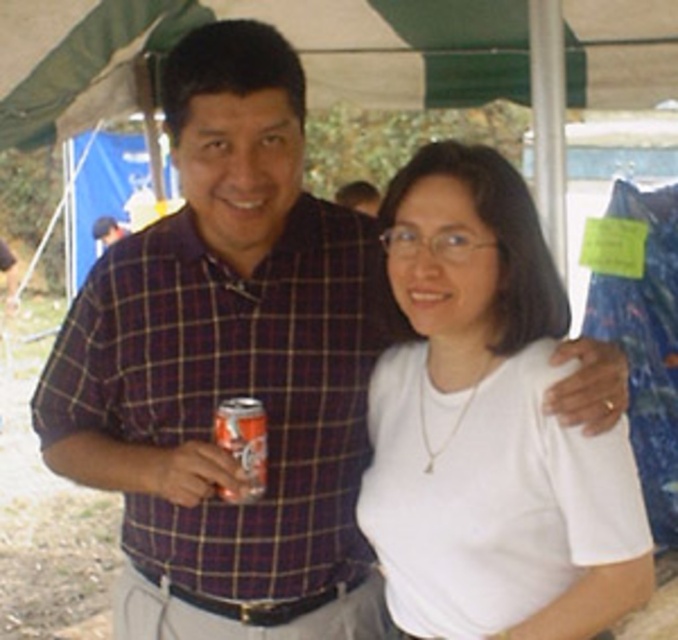
Question: Can you confirm if plaid cotton shirt at center is positioned to the right of orange aluminum can at center?

Choices:
 (A) yes
 (B) no

Answer: (B)

Question: Which point is closer to the camera?

Choices:
 (A) pyautogui.click(x=5, y=300)
 (B) pyautogui.click(x=233, y=426)

Answer: (B)

Question: Can you confirm if white matte shirt at center is positioned to the right of plaid fabric shirt at center?

Choices:
 (A) yes
 (B) no

Answer: (A)

Question: Is plaid cotton shirt at center to the right of orange aluminum can at center from the viewer's perspective?

Choices:
 (A) no
 (B) yes

Answer: (A)

Question: Which of the following is the farthest from the observer?

Choices:
 (A) (x=7, y=280)
 (B) (x=376, y=304)

Answer: (A)

Question: Which object is positioned closest to the white matte shirt at center?

Choices:
 (A) plaid cotton shirt at center
 (B) plaid fabric shirt at center

Answer: (A)